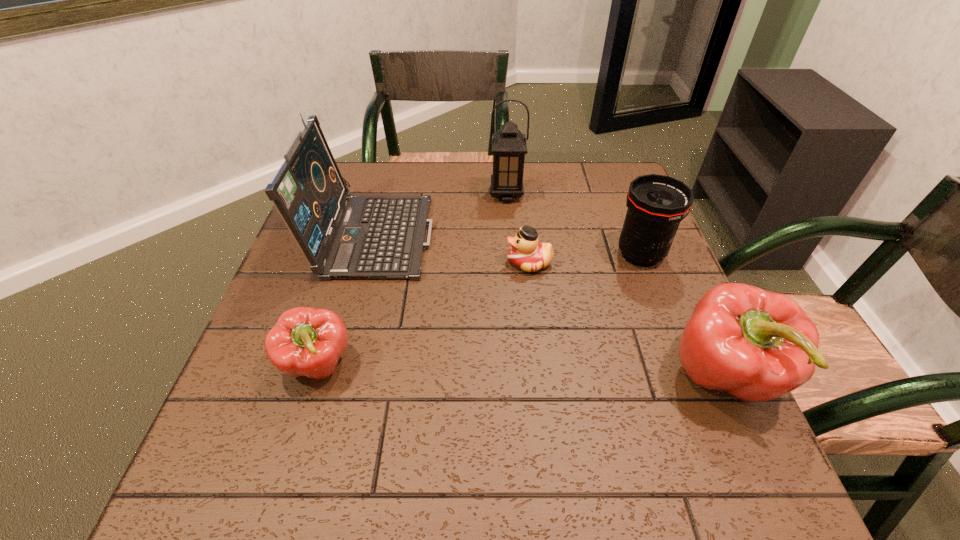
Where is `vacant position for inserting another pepper evenly`? The height and width of the screenshot is (540, 960). vacant position for inserting another pepper evenly is located at coordinates click(519, 370).